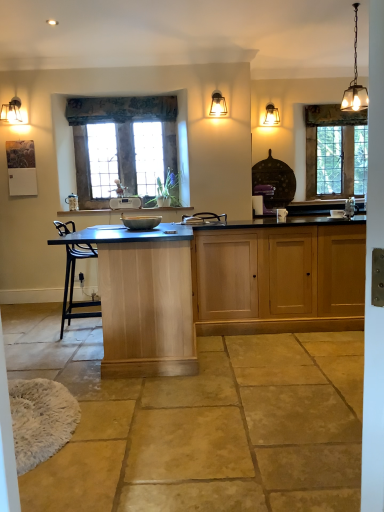
Question: Is white plastic toaster at center aimed at matte black lampshade at upper left?

Choices:
 (A) no
 (B) yes

Answer: (A)

Question: Are white plastic toaster at center and matte black lampshade at upper left located far from each other?

Choices:
 (A) no
 (B) yes

Answer: (B)

Question: Does white plastic toaster at center come behind matte black lampshade at upper left?

Choices:
 (A) yes
 (B) no

Answer: (A)

Question: Can you confirm if white plastic toaster at center is bigger than matte black lampshade at upper left?

Choices:
 (A) no
 (B) yes

Answer: (A)

Question: From the image's perspective, is white plastic toaster at center under matte black lampshade at upper left?

Choices:
 (A) yes
 (B) no

Answer: (A)

Question: From the image's perspective, is matte glass pendant light at upper right, the third light fixture in the front-to-back sequence, above or below white plastic toaster at center?

Choices:
 (A) below
 (B) above

Answer: (B)

Question: In the image, is matte glass pendant light at upper right, which appears as the second light fixture when viewed from the left, on the left side or the right side of white plastic toaster at center?

Choices:
 (A) right
 (B) left

Answer: (A)

Question: From a real-world perspective, is matte glass pendant light at upper right, which ranks as the second light fixture in right-to-left order, positioned above or below white plastic toaster at center?

Choices:
 (A) above
 (B) below

Answer: (A)

Question: Considering the positions of matte glass pendant light at upper right, marked as the 1th light fixture in a back-to-front arrangement, and white plastic toaster at center in the image, is matte glass pendant light at upper right, marked as the 1th light fixture in a back-to-front arrangement, wider or thinner than white plastic toaster at center?

Choices:
 (A) wide
 (B) thin

Answer: (A)

Question: Does point (218, 115) appear closer or farther from the camera than point (114, 208)?

Choices:
 (A) farther
 (B) closer

Answer: (B)

Question: Considering the positions of matte glass pendant light at upper center, which is the 2th light fixture from back to front, and white plastic toaster at center in the image, is matte glass pendant light at upper center, which is the 2th light fixture from back to front, bigger or smaller than white plastic toaster at center?

Choices:
 (A) small
 (B) big

Answer: (B)

Question: From the image's perspective, relative to white plastic toaster at center, is matte glass pendant light at upper center, the 2th light fixture viewed from the front, above or below?

Choices:
 (A) above
 (B) below

Answer: (A)

Question: From their relative heights in the image, would you say matte glass pendant light at upper center, the 2th light fixture viewed from the front, is taller or shorter than white plastic toaster at center?

Choices:
 (A) tall
 (B) short

Answer: (A)

Question: From the image's perspective, is light oak cabinet at center located above or below matte black lampshade at upper left?

Choices:
 (A) above
 (B) below

Answer: (B)

Question: Is light oak cabinet at center situated inside matte black lampshade at upper left or outside?

Choices:
 (A) inside
 (B) outside

Answer: (B)